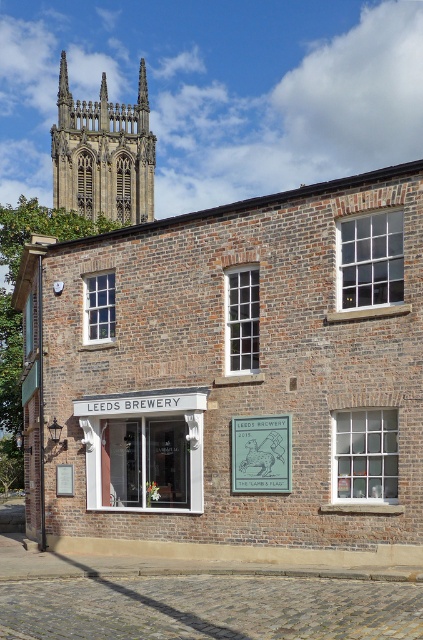
Question: Which point appears farthest from the camera in this image?

Choices:
 (A) (191, 396)
 (B) (290, 465)
 (C) (118, 166)

Answer: (C)

Question: Is white wooden signboard at center positioned behind dark brown stone tower at upper left?

Choices:
 (A) yes
 (B) no

Answer: (B)

Question: Among these points, which one is nearest to the camera?

Choices:
 (A) (96, 452)
 (B) (101, 134)
 (C) (264, 419)

Answer: (C)

Question: Which point is farther to the camera?

Choices:
 (A) (279, 456)
 (B) (147, 104)
 (C) (121, 432)

Answer: (B)

Question: Can you confirm if dark brown stone tower at upper left is positioned above green metal sign at center?

Choices:
 (A) no
 (B) yes

Answer: (B)

Question: From the image, what is the correct spatial relationship of white wooden signboard at center in relation to dark brown stone tower at upper left?

Choices:
 (A) above
 (B) below

Answer: (B)